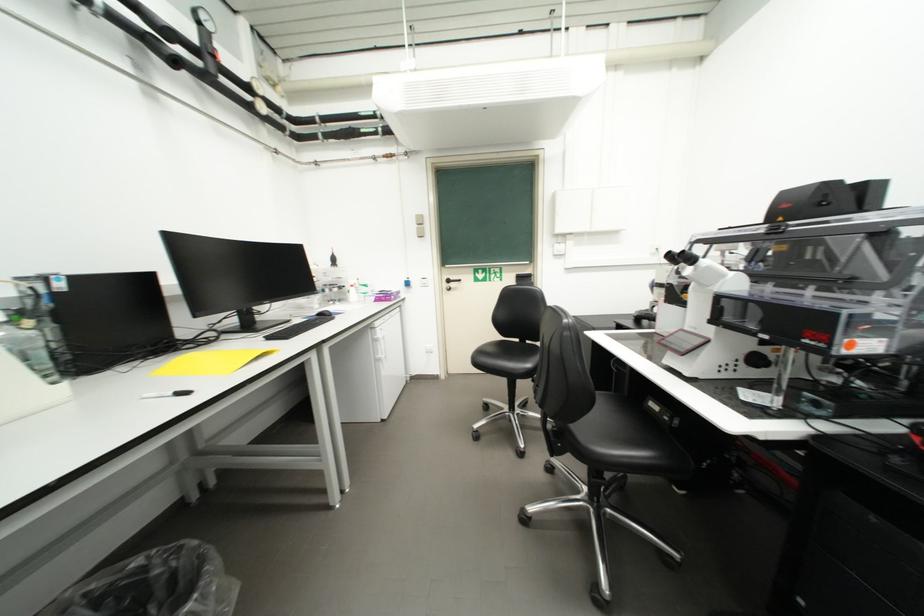
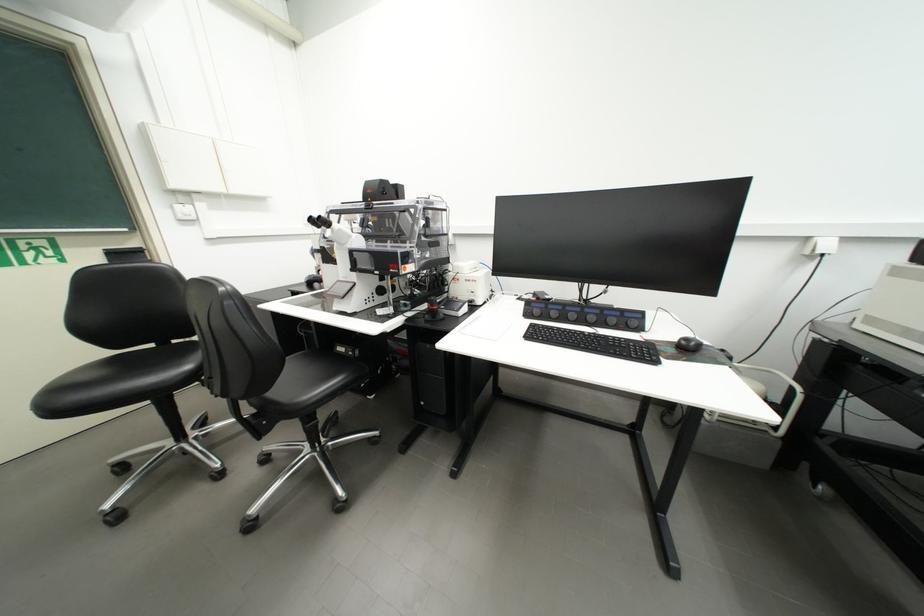
Where in the second image is the point corresponding to the point at 525,341 from the first image?

(160, 347)